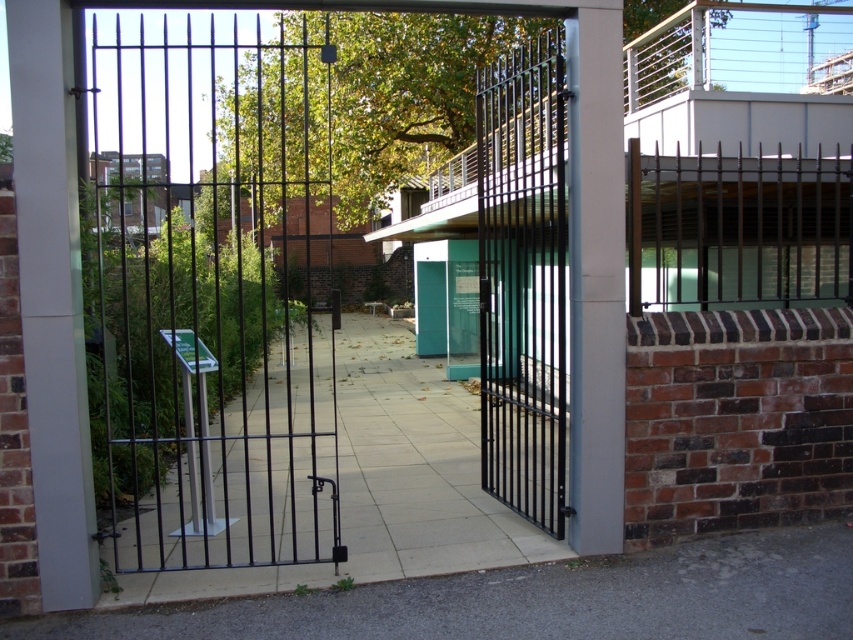
Is gray concrete pavement at lower center smaller than dark brown metal fence at upper right?

Yes.

The width and height of the screenshot is (853, 640). Describe the element at coordinates (538, 600) in the screenshot. I see `gray concrete pavement at lower center` at that location.

Image resolution: width=853 pixels, height=640 pixels. I want to click on gray concrete pavement at lower center, so click(x=538, y=600).

What are the coordinates of `gray concrete pavement at lower center` in the screenshot? It's located at (538, 600).

Which is behind, point (590, 616) or point (474, 497)?

The point (474, 497) is behind.

The image size is (853, 640). Find the location of `gray concrete pavement at lower center`. gray concrete pavement at lower center is located at coordinates (538, 600).

Locate an element on the screen. gray concrete pavement at lower center is located at coordinates (538, 600).

Between slate paving at center and dark brown metal fence at upper right, which one appears on the right side from the viewer's perspective?

→ Positioned to the right is dark brown metal fence at upper right.

Can you confirm if slate paving at center is wider than dark brown metal fence at upper right?

In fact, slate paving at center might be narrower than dark brown metal fence at upper right.

The width and height of the screenshot is (853, 640). What are the coordinates of `slate paving at center` in the screenshot? It's located at (415, 467).